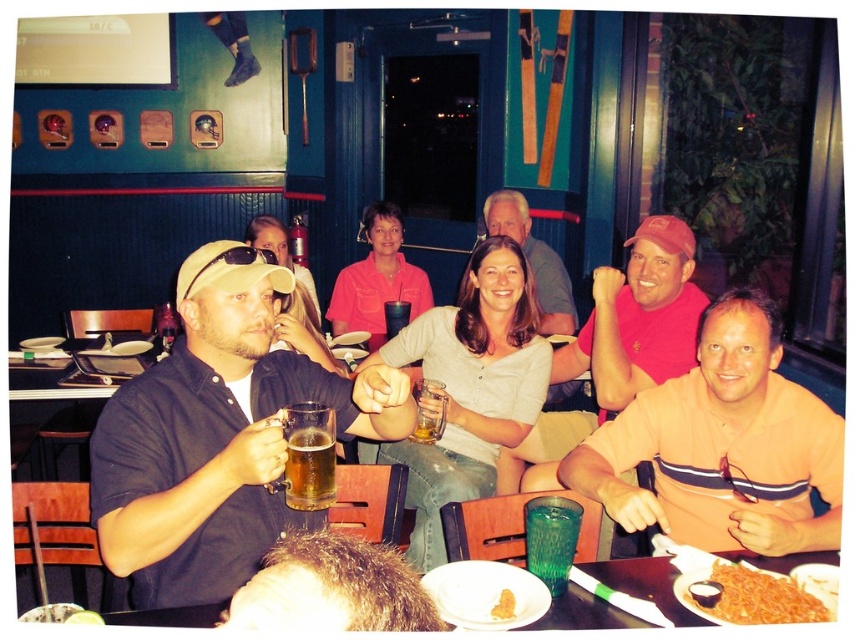
You are a waiter at this sports bar and need to deliver a drink to the customer wearing the orange striped shirt at right. The coordinate system starts at the bottom left corner of the image. The x and y coordinates of the orange striped shirt at right are given as point (722, 445). If the table is located at coordinates 0.5, 0.5, in which direction should you move relative to the table to reach the orange striped shirt at right?

The point (722, 445) for the orange striped shirt at right is northeast of the table at 0.5, 0.5. Move northeast to reach the orange striped shirt at right.